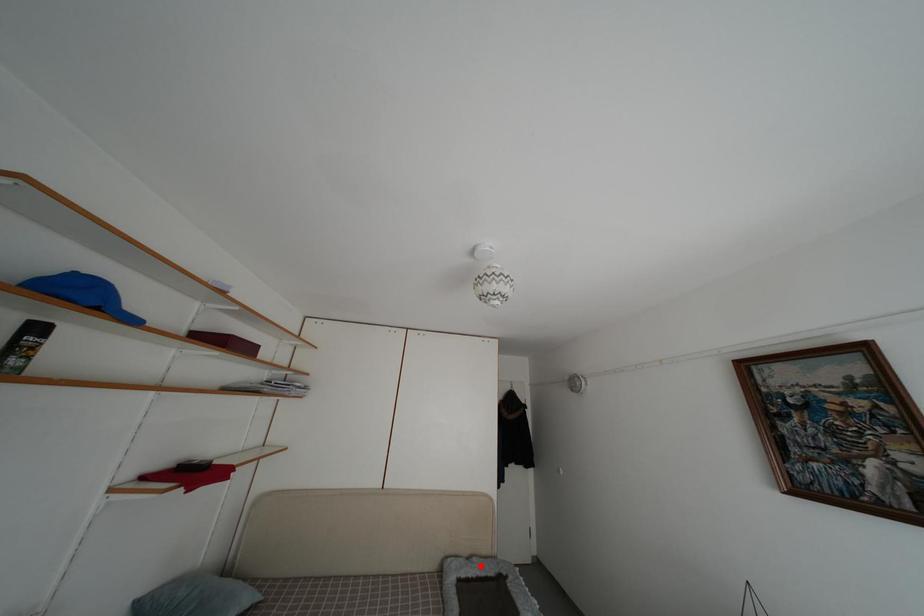
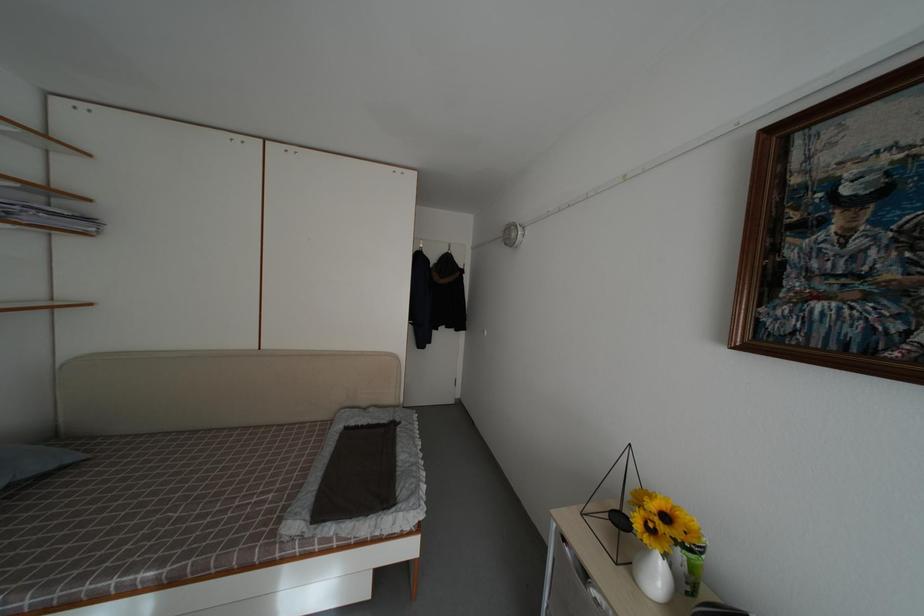
Where in the second image is the point corresponding to the highlighted location from the first image?

(378, 416)